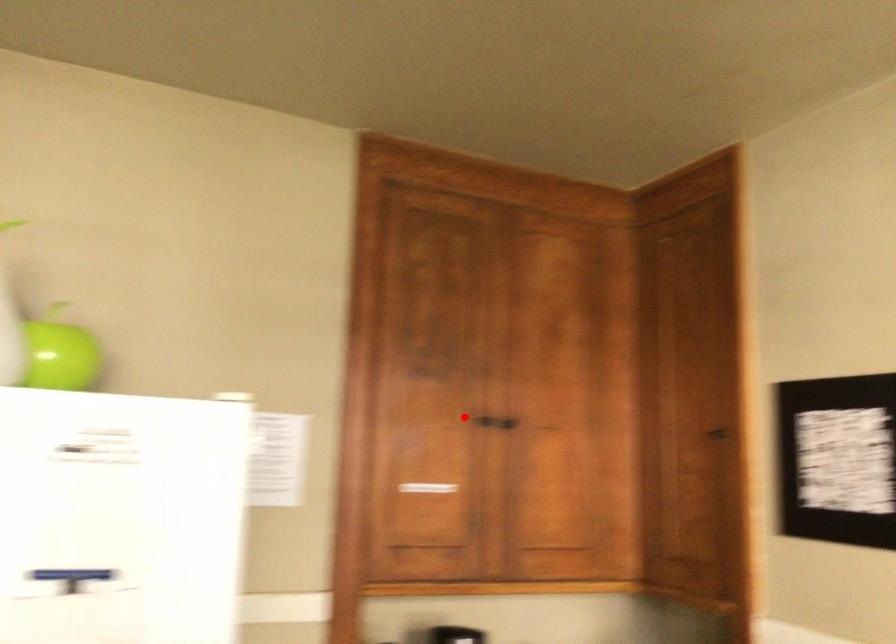
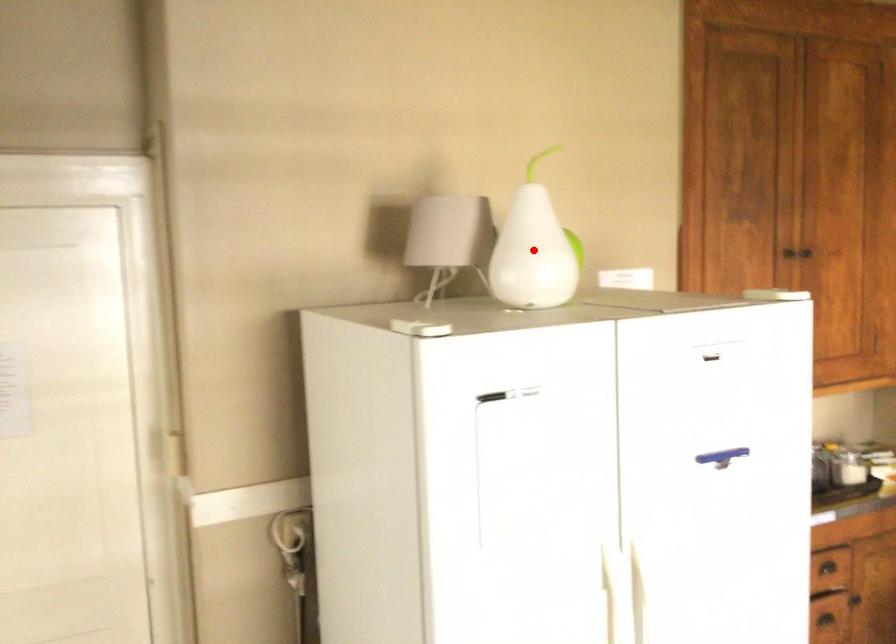
I am providing you with two images of the same scene from different viewpoints. A red point is marked on the first image and another point is marked on the second image. Do the highlighted points in image1 and image2 indicate the same real-world spot?

No